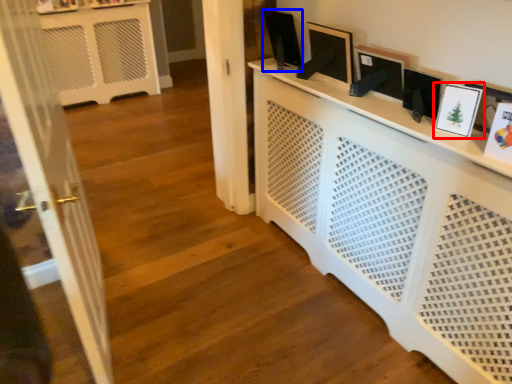
Question: Which of the following is the farthest to the observer, picture frame (highlighted by a red box) or picture frame (highlighted by a blue box)?

Choices:
 (A) picture frame
 (B) picture frame

Answer: (B)